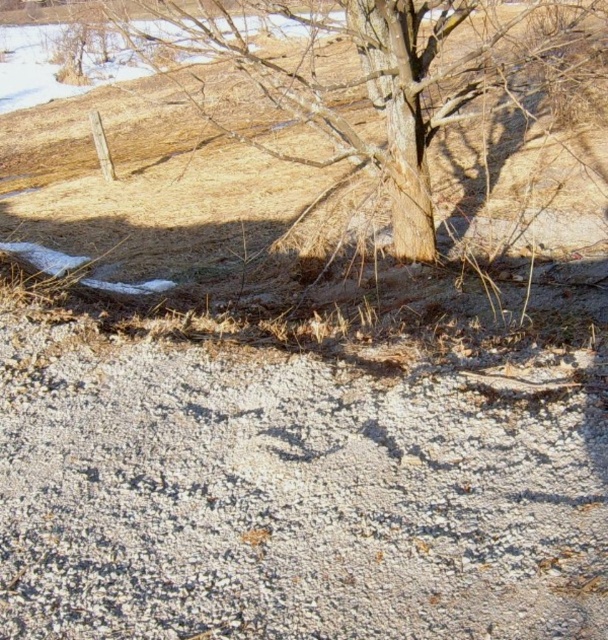
Question: Can you confirm if gray gravelly dirt track at lower center is bigger than brown rough bark tree at center?

Choices:
 (A) no
 (B) yes

Answer: (A)

Question: Which object appears closest to the camera in this image?

Choices:
 (A) gray gravelly dirt track at lower center
 (B) brown rough bark tree at center

Answer: (A)

Question: Which point appears closest to the camera in this image?

Choices:
 (A) (143, 467)
 (B) (457, 115)

Answer: (A)

Question: Can you confirm if gray gravelly dirt track at lower center is smaller than brown rough bark tree at center?

Choices:
 (A) no
 (B) yes

Answer: (B)

Question: Does gray gravelly dirt track at lower center appear on the left side of brown rough bark tree at center?

Choices:
 (A) no
 (B) yes

Answer: (B)